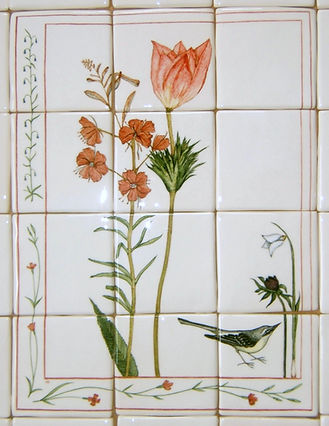
Where is `white tile background`? white tile background is located at coordinates (199, 258).